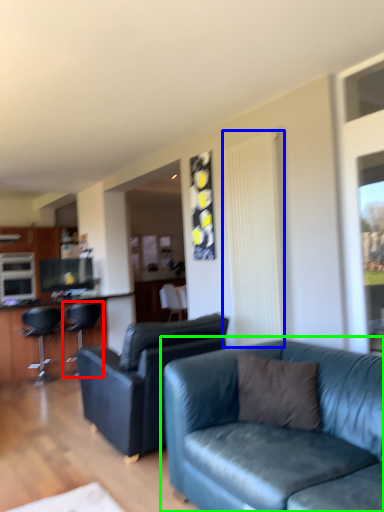
Question: Which object is positioned farthest from chair (highlighted by a red box)? Select from curtain (highlighted by a blue box) and studio couch (highlighted by a green box).

Choices:
 (A) curtain
 (B) studio couch

Answer: (B)